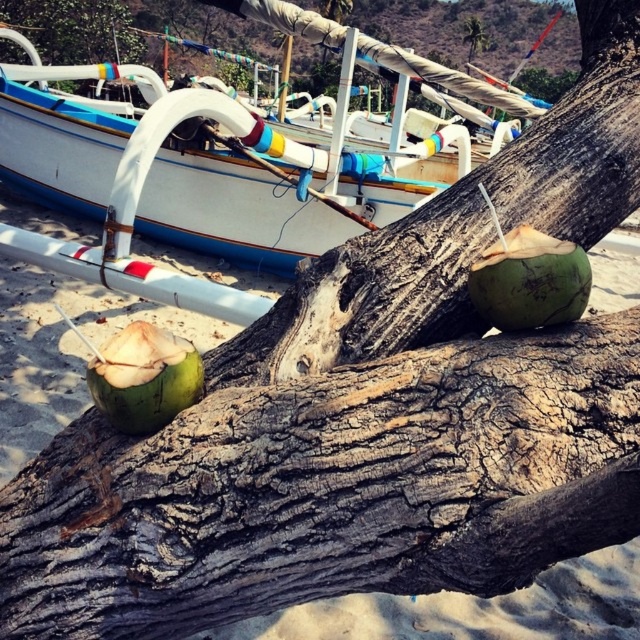
You are a photographer trying to capture both the green rough bark tree trunk at center and the brown rough tree trunk at upper left in a single frame. Based on their positions, which tree trunk should you adjust your camera angle to focus on first to include both in the shot?

The green rough bark tree trunk at center is positioned on the right side of brown rough tree trunk at upper left. To include both in the shot, you should focus on the brown rough tree trunk at upper left first, as it is on the left side, allowing you to adjust your angle to capture both the left and right positioned trunks in the frame.

You are a photographer planning to capture both the white painted wood boat at upper left and the green rough coconut at center in a single frame. Given their sizes, which object will occupy more space in your photo?

The white painted wood boat at upper left will occupy more space in the photo since its width surpasses that of the green rough coconut at center.

Looking at this image, you are a beach vendor who wants to display the green matte coconut at center and the green rough bark tree at upper center in a promotional photo. Since you have a limited space, you need to arrange them so that the smaller object is placed closer to the camera to appear the same size as the larger one. Which object should you move closer to the camera?

The green matte coconut at center is smaller than the green rough bark tree at upper center. To make them appear the same size in the photo, you should move the green matte coconut at center closer to the camera since it is smaller and needs to be magnified to match the size of the larger tree.